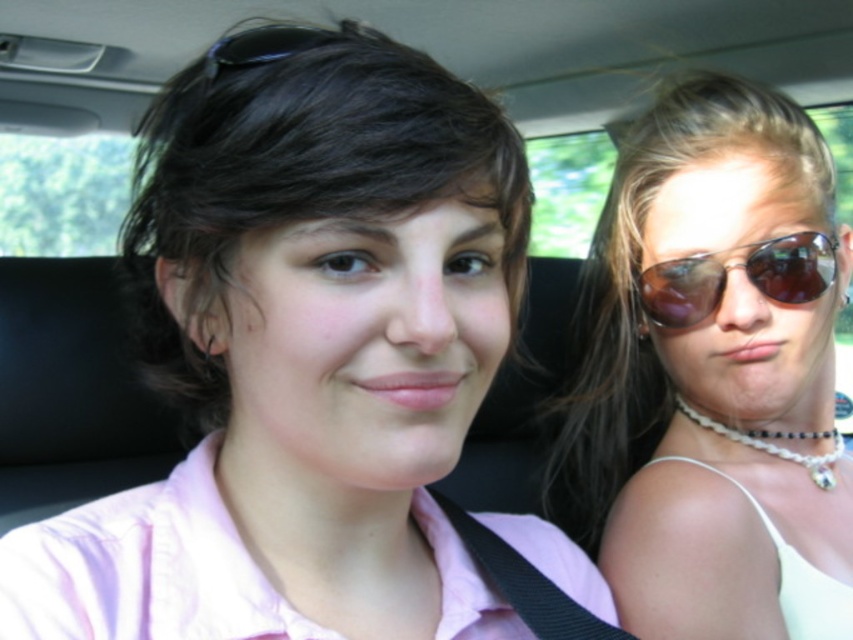
You are a passenger in the backseat of a car and want to borrow the sunglasses at right. Where should you look to find them?

You should look at point [709,365] to find the sunglasses at right.

You are standing in front of a car window and want to touch the point at coordinates point (456, 80) inside the vehicle. If your hand can reach 15 inches, will you be able to reach it?

The point (456, 80) is 15.59 inches away from the viewer, so your hand can reach it since 15.59 inches is within the 15 inches reach limit.

You are a photographer trying to capture a closeup of the two points in the image. The points are located at coordinates point (757, 196) and point (810, 230). Based on their positions, which point should you focus on first to ensure it appears sharp in the photo?

Point (757, 196) is closer to the camera than point (810, 230), so you should focus on point (757, 196) first to ensure it appears sharp in the photo.